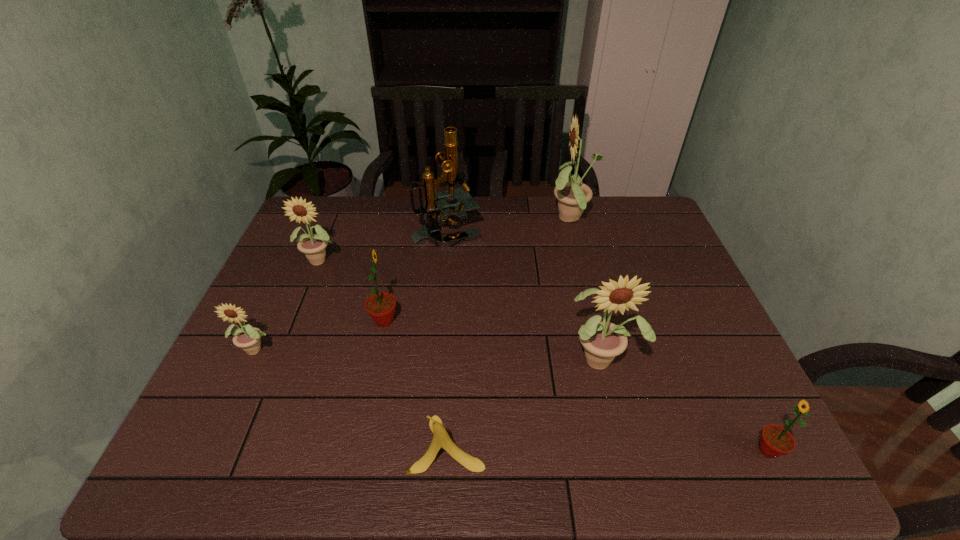
Identify the location of the right green sunflower. This screenshot has width=960, height=540. (775, 441).

Locate an element on the screen. The width and height of the screenshot is (960, 540). the nearer green sunflower is located at coordinates (775, 441).

The width and height of the screenshot is (960, 540). Find the location of `the shortest object`. the shortest object is located at coordinates (441, 439).

I want to click on vacant point located on the front-facing side of the farthest yellow sunflower, so click(499, 220).

Where is `blank area located on the front-facing side of the farthest yellow sunflower`? The height and width of the screenshot is (540, 960). blank area located on the front-facing side of the farthest yellow sunflower is located at coordinates (499, 220).

You are a GUI agent. You are given a task and a screenshot of the screen. Output one action in this format:
    pyautogui.click(x=<x>, y=<y>)
    Task: Click on the free space located 0.300m on the front-facing side of the farthest yellow sunflower
    
    Given the screenshot: What is the action you would take?
    pyautogui.click(x=458, y=220)

The image size is (960, 540). I want to click on vacant area situated 0.340m at the eyepiece of the microscope, so click(584, 230).

Where is `free space located on the front-facing side of the second biggest yellow sunflower`? The image size is (960, 540). free space located on the front-facing side of the second biggest yellow sunflower is located at coordinates (618, 427).

This screenshot has width=960, height=540. Find the location of `vacant space located on the face of the fourth nearest sunflower`. vacant space located on the face of the fourth nearest sunflower is located at coordinates (532, 321).

Find the location of a particular element. vacant space located 0.170m on the front-facing side of the third farthest object is located at coordinates (300, 315).